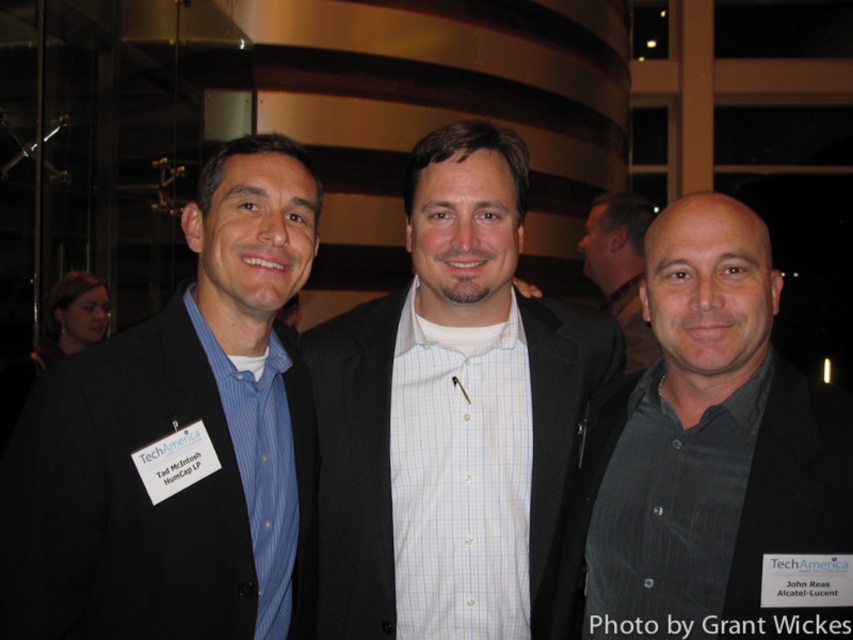
Question: Which object is the farthest from the gray pinstripe shirt at center?

Choices:
 (A) white checkered shirt at center
 (B) gray textured shirt at center
 (C) matte black suit at left

Answer: (B)

Question: Can you confirm if matte black suit at left is smaller than gray textured shirt at center?

Choices:
 (A) no
 (B) yes

Answer: (B)

Question: Among these points, which one is farthest from the camera?

Choices:
 (A) (15, 472)
 (B) (799, 486)
 (C) (492, 442)

Answer: (C)

Question: Does matte black suit at left appear under gray pinstripe shirt at center?

Choices:
 (A) no
 (B) yes

Answer: (A)

Question: Which is nearer to the gray pinstripe shirt at center?

Choices:
 (A) gray textured shirt at center
 (B) matte black suit at left
 (C) white checkered shirt at center

Answer: (C)

Question: Does white checkered shirt at center come behind gray pinstripe shirt at center?

Choices:
 (A) yes
 (B) no

Answer: (A)